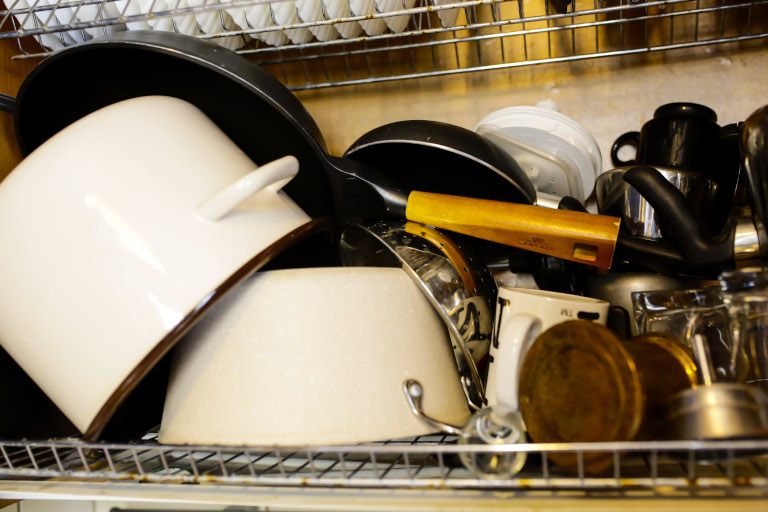
You are a GUI agent. You are given a task and a screenshot of the screen. Output one action in this format:
    pyautogui.click(x=<x>, y=<y>)
    Task: Click on the glass
    
    Given the screenshot: What is the action you would take?
    pyautogui.click(x=710, y=314), pyautogui.click(x=746, y=302)